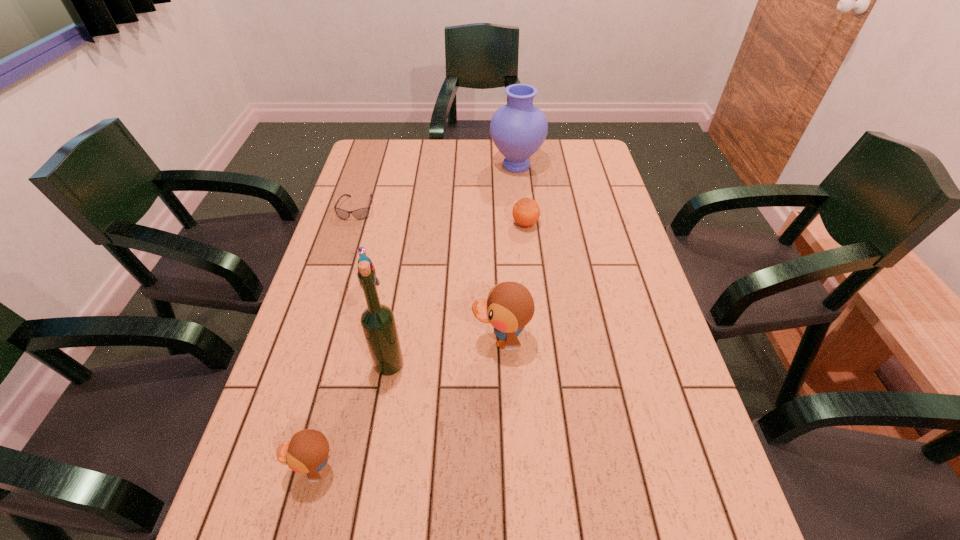
Where is `vacant space that satisfies the following two spatial constraints: 1. on the back side of the fourth nearest object; 2. on the right side of the vase`? This screenshot has width=960, height=540. vacant space that satisfies the following two spatial constraints: 1. on the back side of the fourth nearest object; 2. on the right side of the vase is located at coordinates (397, 166).

The height and width of the screenshot is (540, 960). What are the coordinates of `free location that satisfies the following two spatial constraints: 1. on the back side of the sixth shortest object; 2. on the left side of the soda` in the screenshot? It's located at (397, 166).

Where is `free space that satisfies the following two spatial constraints: 1. on the front side of the liquor; 2. on the front-facing side of the left duck`? free space that satisfies the following two spatial constraints: 1. on the front side of the liquor; 2. on the front-facing side of the left duck is located at coordinates (372, 468).

Locate an element on the screen. The image size is (960, 540). vacant space that satisfies the following two spatial constraints: 1. on the front side of the second tallest object; 2. on the right side of the orange is located at coordinates (522, 224).

Locate an element on the screen. The width and height of the screenshot is (960, 540). vacant point that satisfies the following two spatial constraints: 1. on the front side of the sixth shortest object; 2. on the front-facing side of the taller duck is located at coordinates [535, 340].